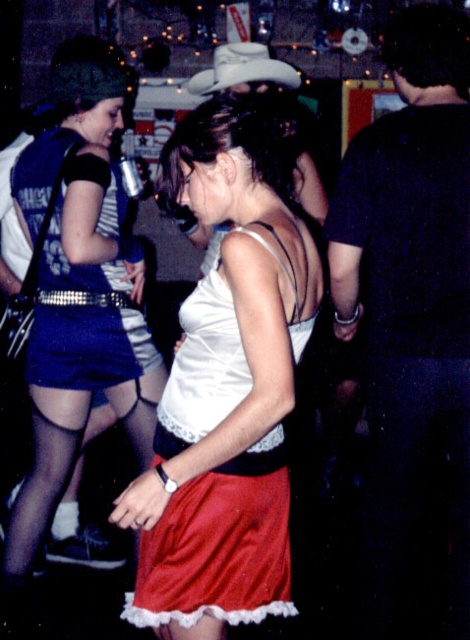
Between white satin tank top at center and matte black dress at center, which one appears on the right side from the viewer's perspective?

white satin tank top at center

Does white satin tank top at center have a lesser width compared to matte black dress at center?

Correct, white satin tank top at center's width is less than matte black dress at center's.

Image resolution: width=470 pixels, height=640 pixels. I want to click on white satin tank top at center, so click(x=228, y=381).